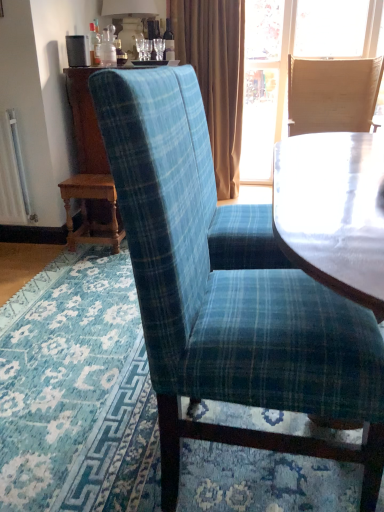
Question: Is white ceramic lamp at upper center further to the viewer compared to brown velvet curtain at upper center?

Choices:
 (A) no
 (B) yes

Answer: (A)

Question: Is white ceramic lamp at upper center smaller than brown velvet curtain at upper center?

Choices:
 (A) no
 (B) yes

Answer: (B)

Question: From the image's perspective, is white ceramic lamp at upper center beneath brown velvet curtain at upper center?

Choices:
 (A) yes
 (B) no

Answer: (B)

Question: Could you tell me if white ceramic lamp at upper center is turned towards brown velvet curtain at upper center?

Choices:
 (A) yes
 (B) no

Answer: (A)

Question: From a real-world perspective, does white ceramic lamp at upper center sit lower than brown velvet curtain at upper center?

Choices:
 (A) yes
 (B) no

Answer: (B)

Question: Is white ceramic lamp at upper center turned away from brown velvet curtain at upper center?

Choices:
 (A) no
 (B) yes

Answer: (A)

Question: Does white ceramic lamp at upper center have a greater width compared to light brown woven chair at upper right, acting as the second chair starting from the left?

Choices:
 (A) yes
 (B) no

Answer: (B)

Question: Considering the relative sizes of white ceramic lamp at upper center and light brown woven chair at upper right, acting as the first chair starting from the back, in the image provided, is white ceramic lamp at upper center shorter than light brown woven chair at upper right, acting as the first chair starting from the back,?

Choices:
 (A) yes
 (B) no

Answer: (A)

Question: From a real-world perspective, is white ceramic lamp at upper center physically above light brown woven chair at upper right, acting as the second chair starting from the left?

Choices:
 (A) no
 (B) yes

Answer: (B)

Question: Would you say white ceramic lamp at upper center is a long distance from light brown woven chair at upper right, which is the 1th chair in right-to-left order?

Choices:
 (A) no
 (B) yes

Answer: (B)

Question: Does white ceramic lamp at upper center turn towards light brown woven chair at upper right, which ranks as the 2th chair in bottom-to-top order?

Choices:
 (A) no
 (B) yes

Answer: (B)

Question: Does white ceramic lamp at upper center have a greater height compared to light brown woven chair at upper right, which is the 1th chair in right-to-left order?

Choices:
 (A) no
 (B) yes

Answer: (A)

Question: Is brown velvet curtain at upper center at the right side of light brown woven chair at upper right, the 2th chair from the front?

Choices:
 (A) yes
 (B) no

Answer: (B)